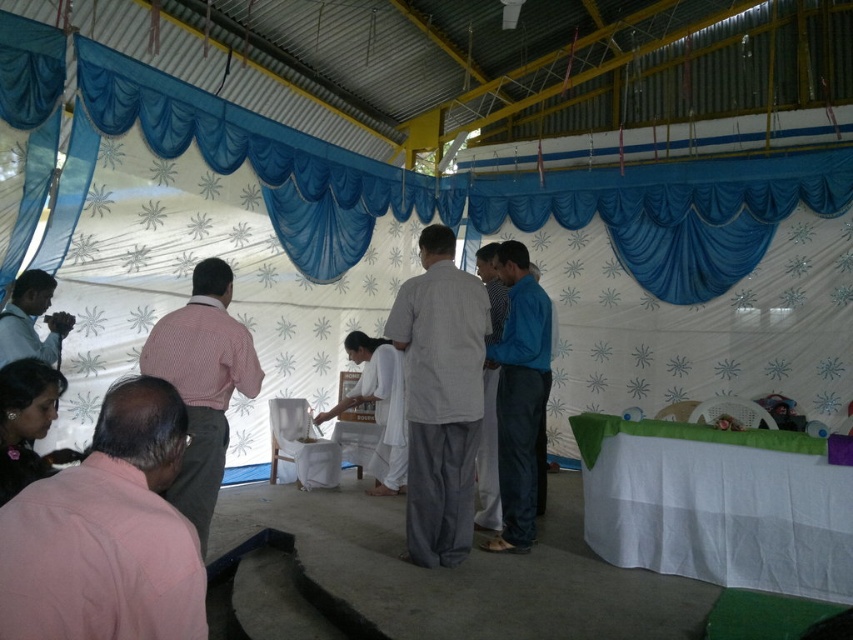
You are organizing a clothing donation drive and need to decide which shirts to pack first. The pink cotton shirt at lower left and the light gray cotton shirt at center are both available. Based on their thickness, which one should you pack first if you want to maximize the number of shirts in a limited space?

The pink cotton shirt at lower left is thinner than the light gray cotton shirt at center, so packing the pink cotton shirt at lower left first would allow more shirts to fit in the limited space.